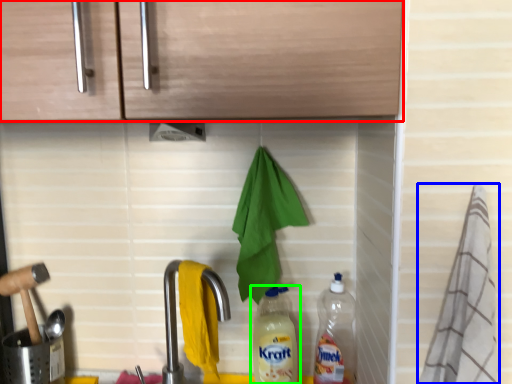
Question: Which is farther away from cabinetry (highlighted by a red box)? material (highlighted by a blue box) or bottle (highlighted by a green box)?

Choices:
 (A) material
 (B) bottle

Answer: (B)